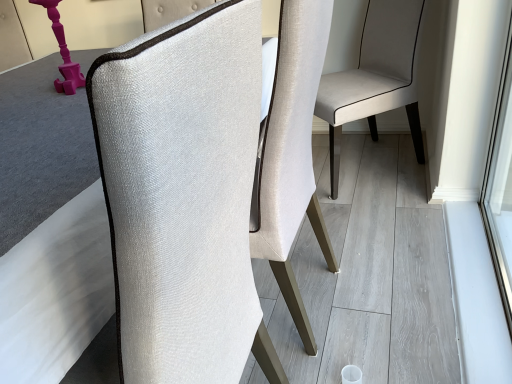
Question: Could you tell me if textured beige chair at center, placed as the second chair when sorted from front to back, is turned towards matte pink plastic table lamp at left?

Choices:
 (A) no
 (B) yes

Answer: (B)

Question: Is matte pink plastic table lamp at left at the back of textured beige chair at center, placed as the second chair when sorted from front to back?

Choices:
 (A) no
 (B) yes

Answer: (A)

Question: Can we say textured beige chair at center, placed as the second chair when sorted from front to back, lies outside matte pink plastic table lamp at left?

Choices:
 (A) no
 (B) yes

Answer: (B)

Question: Is textured beige chair at center, placed as the second chair when sorted from front to back, to the left of matte pink plastic table lamp at left from the viewer's perspective?

Choices:
 (A) yes
 (B) no

Answer: (B)

Question: Can you confirm if textured beige chair at center, placed as the second chair when sorted from front to back, is bigger than matte pink plastic table lamp at left?

Choices:
 (A) yes
 (B) no

Answer: (A)

Question: From a real-world perspective, is textured fabric chair at center, placed as the 1th chair when sorted from front to back, physically located above or below matte pink plastic table lamp at left?

Choices:
 (A) below
 (B) above

Answer: (A)

Question: Do you think textured fabric chair at center, the second chair positioned from the back, is within matte pink plastic table lamp at left, or outside of it?

Choices:
 (A) outside
 (B) inside

Answer: (A)

Question: Is textured fabric chair at center, the second chair positioned from the back, to the left or to the right of matte pink plastic table lamp at left in the image?

Choices:
 (A) left
 (B) right

Answer: (B)

Question: Is textured fabric chair at center, the second chair positioned from the back, wider or thinner than matte pink plastic table lamp at left?

Choices:
 (A) thin
 (B) wide

Answer: (B)

Question: Considering the positions of point (79, 86) and point (409, 117), is point (79, 86) closer or farther from the camera than point (409, 117)?

Choices:
 (A) farther
 (B) closer

Answer: (B)

Question: Is matte pink plastic table lamp at left taller or shorter than textured beige chair at center, which ranks as the 1th chair in back-to-front order?

Choices:
 (A) tall
 (B) short

Answer: (B)

Question: In the image, is matte pink plastic table lamp at left on the left side or the right side of textured beige chair at center, which ranks as the 1th chair in back-to-front order?

Choices:
 (A) right
 (B) left

Answer: (B)

Question: In the image, is matte pink plastic table lamp at left positioned in front of or behind textured beige chair at center, which ranks as the 1th chair in back-to-front order?

Choices:
 (A) behind
 (B) front

Answer: (B)

Question: From a real-world perspective, is matte pink plastic table lamp at left above or below textured fabric chair at center, placed as the 1th chair when sorted from front to back?

Choices:
 (A) above
 (B) below

Answer: (A)

Question: Looking at the image, does matte pink plastic table lamp at left seem bigger or smaller compared to textured fabric chair at center, placed as the 1th chair when sorted from front to back?

Choices:
 (A) small
 (B) big

Answer: (A)